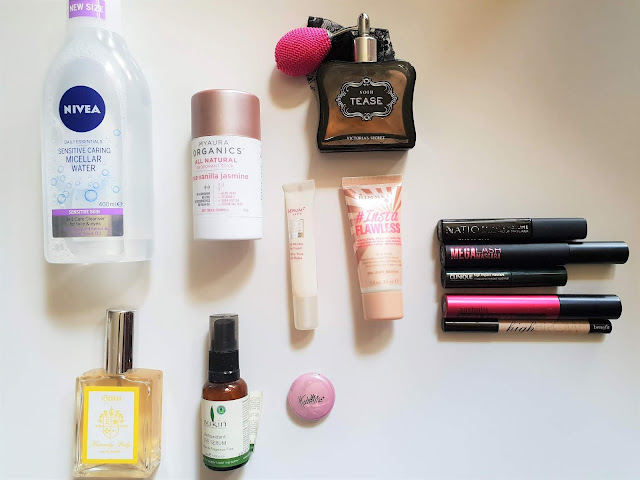
The height and width of the screenshot is (480, 640). Identify the location of bottle. (109, 206).